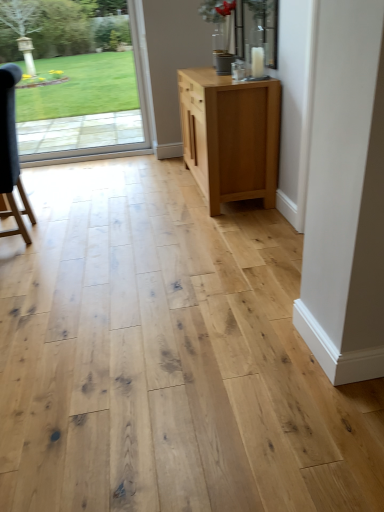
Question: From a real-world perspective, is natural wood cabinet at center over dark gray fabric chair at left?

Choices:
 (A) no
 (B) yes

Answer: (A)

Question: Is natural wood cabinet at center not within dark gray fabric chair at left?

Choices:
 (A) no
 (B) yes

Answer: (B)

Question: Does natural wood cabinet at center have a smaller size compared to dark gray fabric chair at left?

Choices:
 (A) no
 (B) yes

Answer: (A)

Question: Can you confirm if natural wood cabinet at center is wider than dark gray fabric chair at left?

Choices:
 (A) yes
 (B) no

Answer: (A)

Question: Does natural wood cabinet at center come behind dark gray fabric chair at left?

Choices:
 (A) no
 (B) yes

Answer: (B)

Question: Is transparent glass door at upper left situated inside dark gray fabric chair at left or outside?

Choices:
 (A) outside
 (B) inside

Answer: (A)

Question: From a real-world perspective, is transparent glass door at upper left physically located above or below dark gray fabric chair at left?

Choices:
 (A) above
 (B) below

Answer: (A)

Question: Considering the relative positions of transparent glass door at upper left and dark gray fabric chair at left in the image provided, is transparent glass door at upper left to the left or to the right of dark gray fabric chair at left?

Choices:
 (A) left
 (B) right

Answer: (B)

Question: In the image, is transparent glass door at upper left positioned in front of or behind dark gray fabric chair at left?

Choices:
 (A) front
 (B) behind

Answer: (B)

Question: From a real-world perspective, is natural wood cabinet at center positioned above or below transparent glass door at upper left?

Choices:
 (A) above
 (B) below

Answer: (B)

Question: In terms of size, does natural wood cabinet at center appear bigger or smaller than transparent glass door at upper left?

Choices:
 (A) big
 (B) small

Answer: (A)

Question: Considering their positions, is natural wood cabinet at center located in front of or behind transparent glass door at upper left?

Choices:
 (A) front
 (B) behind

Answer: (A)

Question: Considering the positions of point (231, 101) and point (41, 82), is point (231, 101) closer or farther from the camera than point (41, 82)?

Choices:
 (A) farther
 (B) closer

Answer: (B)

Question: Is transparent glass door at upper left spatially inside natural wood cabinet at center, or outside of it?

Choices:
 (A) outside
 (B) inside

Answer: (A)

Question: In terms of height, does transparent glass door at upper left look taller or shorter compared to natural wood cabinet at center?

Choices:
 (A) short
 (B) tall

Answer: (B)